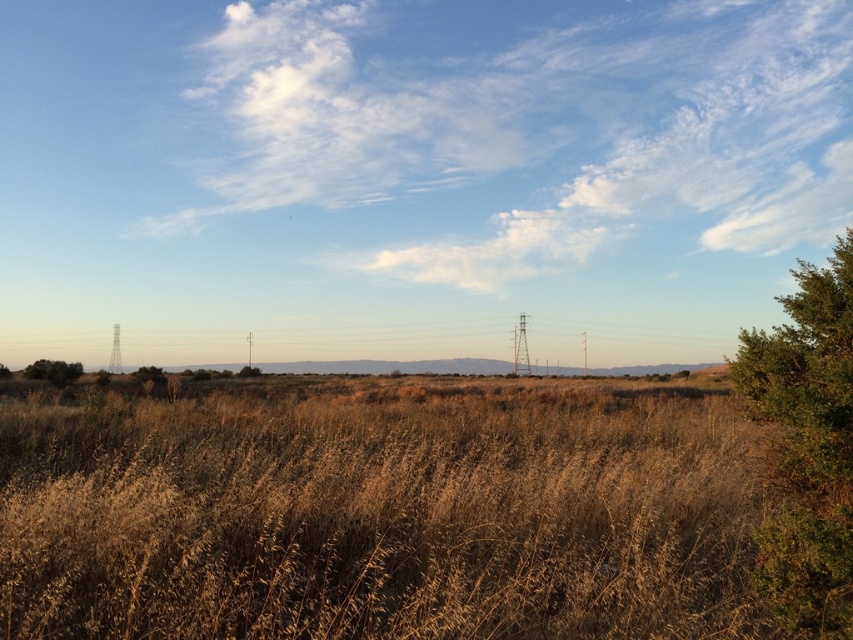
You are standing in the open landscape and want to take a photo of both the green leafy tree at right and the green leafy bush at lower left. Which object should you focus on first to ensure both are in the frame?

You should focus on the green leafy bush at lower left first because the green leafy tree at right is in front of it, so adjusting the framing to include both would require ensuring the background object is also visible.

You are standing at the center of the landscape and want to place a small flag at the point that is farther away from you. Which point should you choose between point (355, 522) and point (770, 573)?

Point (770, 573) is farther away from you, so you should place the flag there.